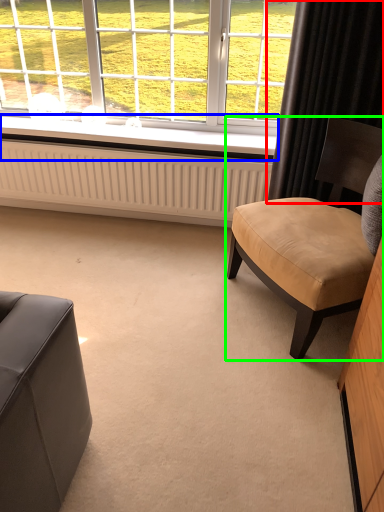
Question: Which object is positioned closest to curtain (highlighted by a red box)? Select from window sill (highlighted by a blue box) and chair (highlighted by a green box).

Choices:
 (A) window sill
 (B) chair

Answer: (B)